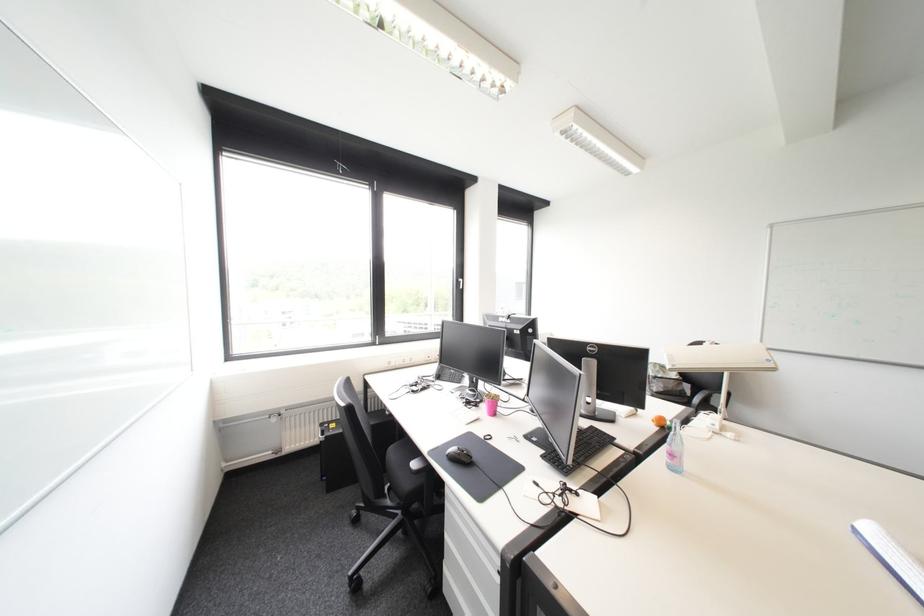
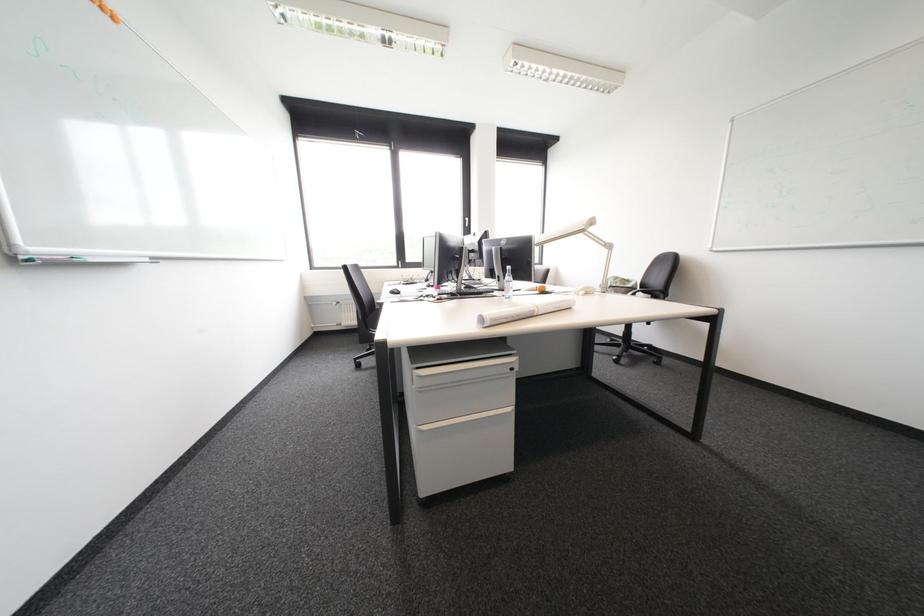
From the picture: What movement of the cameraman would produce the second image?

The cameraman walked toward right, backward.